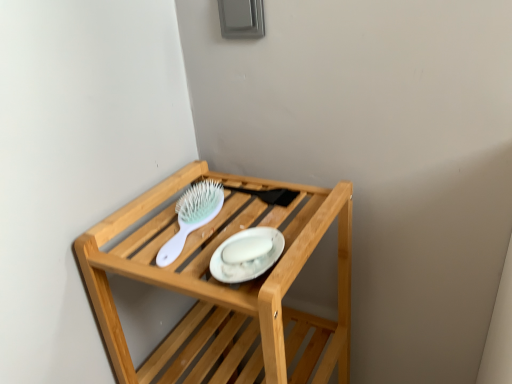
What do you see at coordinates (247, 255) in the screenshot?
I see `white glossy platter at center` at bounding box center [247, 255].

Measure the distance between wooden shelf at upper center and camera.

The depth of wooden shelf at upper center is 52.29 centimeters.

Locate an element on the screen. The width and height of the screenshot is (512, 384). white plastic brush at upper center is located at coordinates (192, 216).

What is the approximate width of white plastic brush at upper center?

8.75 inches.

The height and width of the screenshot is (384, 512). I want to click on white glossy platter at center, so click(247, 255).

In terms of width, does white glossy platter at center look wider or thinner when compared to white plastic brush at upper center?

In the image, white glossy platter at center appears to be more narrow than white plastic brush at upper center.

From a real-world perspective, is white glossy platter at center below white plastic brush at upper center?

No, from a real-world perspective, white glossy platter at center is not under white plastic brush at upper center.

Which object is more forward, white glossy platter at center or white plastic brush at upper center?

white glossy platter at center is closer to the camera.

How many degrees apart are the facing directions of white glossy platter at center and white plastic brush at upper center?

4.64 degrees.

Is wooden shelf at upper center turned away from white glossy platter at center?

No, white glossy platter at center is not at the back of wooden shelf at upper center.

Where is `furniture on the left of white glossy platter at center`? furniture on the left of white glossy platter at center is located at coordinates (225, 285).

Can you confirm if wooden shelf at upper center is wider than white glossy platter at center?

Correct, the width of wooden shelf at upper center exceeds that of white glossy platter at center.

Is point (161, 253) positioned behind point (153, 231)?

No, (161, 253) is closer to viewer.

From the image's perspective, is white plastic brush at upper center positioned above or below wooden shelf at upper center?

Clearly, from the image's perspective, white plastic brush at upper center is above wooden shelf at upper center.

Is white plastic brush at upper center positioned with its back to wooden shelf at upper center?

Yes.

Which of these two, white plastic brush at upper center or wooden shelf at upper center, stands taller?

wooden shelf at upper center is taller.

From the image's perspective, which object appears higher, white plastic brush at upper center or white glossy platter at center?

white plastic brush at upper center.

Is white plastic brush at upper center not within white glossy platter at center?

Yes, white plastic brush at upper center is outside of white glossy platter at center.

From a real-world perspective, is white plastic brush at upper center under white glossy platter at center?

Correct, in the physical world, white plastic brush at upper center is lower than white glossy platter at center.

Is point (181, 223) positioned after point (280, 246)?

Yes, point (181, 223) is farther from viewer.

Is white glossy platter at center outside of wooden shelf at upper center?

Actually, white glossy platter at center is within wooden shelf at upper center.

Find the location of a particular element. The image size is (512, 384). platter that is above the wooden shelf at upper center (from a real-world perspective) is located at coordinates (247, 255).

Does white glossy platter at center appear on the right side of wooden shelf at upper center?

Yes, white glossy platter at center is to the right of wooden shelf at upper center.

Looking at the image, does white glossy platter at center seem bigger or smaller compared to wooden shelf at upper center?

In the image, white glossy platter at center appears to be smaller than wooden shelf at upper center.

Is wooden shelf at upper center turned away from white plastic brush at upper center?

No, wooden shelf at upper center is not facing away from white plastic brush at upper center.

Considering the points (224, 211) and (189, 198), which point is in front, point (224, 211) or point (189, 198)?

Positioned in front is point (224, 211).

Based on the photo, how different are the orientations of wooden shelf at upper center and white plastic brush at upper center in degrees?

wooden shelf at upper center and white plastic brush at upper center are facing 5.11 degrees away from each other.

Between wooden shelf at upper center and white plastic brush at upper center, which one has more height?

wooden shelf at upper center is taller.

Locate an element on the screen. The height and width of the screenshot is (384, 512). brush on the left of white glossy platter at center is located at coordinates (192, 216).

Locate an element on the screen. This screenshot has height=384, width=512. platter behind the wooden shelf at upper center is located at coordinates (247, 255).

When comparing their distances from wooden shelf at upper center, does white glossy platter at center or white plastic brush at upper center seem closer?

The object closer to wooden shelf at upper center is white plastic brush at upper center.

Based on their spatial positions, is white plastic brush at upper center or white glossy platter at center further from wooden shelf at upper center?

Among the two, white glossy platter at center is located further to wooden shelf at upper center.

Estimate the real-world distances between objects in this image. Which object is closer to white glossy platter at center, wooden shelf at upper center or white plastic brush at upper center?

Among the two, white plastic brush at upper center is located nearer to white glossy platter at center.

Looking at the image, which one is located further to white plastic brush at upper center, white glossy platter at center or wooden shelf at upper center?

Based on the image, wooden shelf at upper center appears to be further to white plastic brush at upper center.

When comparing their distances from white glossy platter at center, does white plastic brush at upper center or wooden shelf at upper center seem further?

wooden shelf at upper center is further to white glossy platter at center.

Based on the photo, when comparing their distances from white plastic brush at upper center, does wooden shelf at upper center or white glossy platter at center seem closer?

white glossy platter at center is closer to white plastic brush at upper center.

Where is `platter between white plastic brush at upper center and wooden shelf at upper center from top to bottom`? This screenshot has width=512, height=384. platter between white plastic brush at upper center and wooden shelf at upper center from top to bottom is located at coordinates (247, 255).